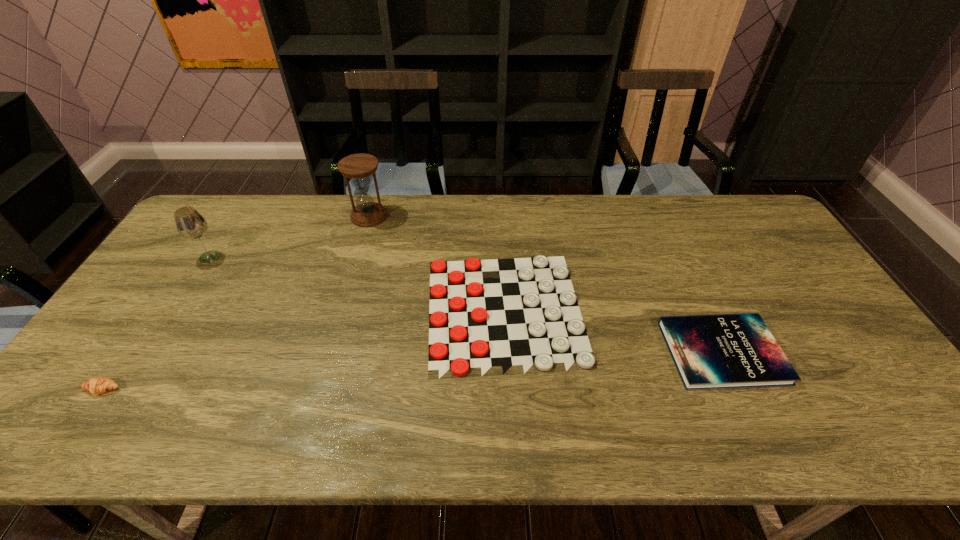
This screenshot has width=960, height=540. What are the coordinates of `empty space between the pastry and the fourth tallest object` in the screenshot? It's located at (412, 371).

Where is `unoccupied area between the farthest object and the fourth shortest object`? unoccupied area between the farthest object and the fourth shortest object is located at coordinates (289, 237).

Identify the location of blank region between the third tallest object and the shortest object. This screenshot has width=960, height=540. (303, 350).

The width and height of the screenshot is (960, 540). I want to click on vacant area that lies between the third shortest object and the second shortest object, so click(412, 371).

You are a GUI agent. You are given a task and a screenshot of the screen. Output one action in this format:
    pyautogui.click(x=<x>, y=<y>)
    Task: Click on the vacant area between the second tallest object and the third shortest object
    
    Given the screenshot: What is the action you would take?
    pyautogui.click(x=156, y=323)

Image resolution: width=960 pixels, height=540 pixels. Find the location of `free area in between the pastry and the checkerboard`. free area in between the pastry and the checkerboard is located at coordinates (303, 350).

This screenshot has height=540, width=960. Find the location of `free space that is in between the second tallest object and the pastry`. free space that is in between the second tallest object and the pastry is located at coordinates (156, 323).

The width and height of the screenshot is (960, 540). I want to click on vacant space that is in between the third tallest object and the hourglass, so click(235, 303).

Find the location of `the second closest object to the checkerboard`. the second closest object to the checkerboard is located at coordinates 358,167.

Locate which object ranks third in proximity to the third object from right to left. Please provide its 2D coordinates. Your answer should be formatted as a tuple, i.e. [(x, y)], where the tuple contains the x and y coordinates of a point satisfying the conditions above.

[(98, 385)]